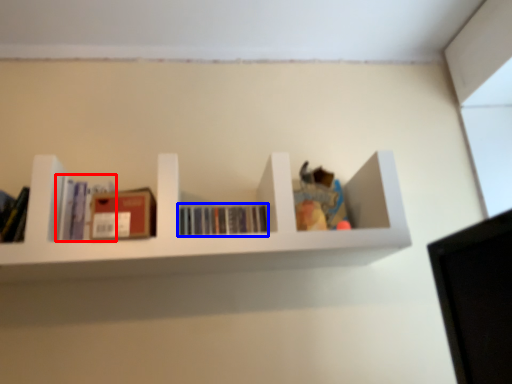
Question: Among these objects, which one is nearest to the camera, book (highlighted by a red box) or book (highlighted by a blue box)?

Choices:
 (A) book
 (B) book

Answer: (A)